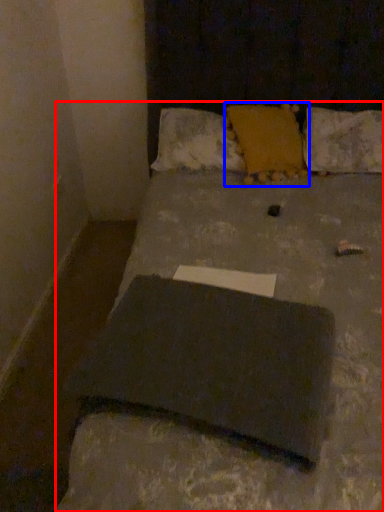
Question: Which object appears closest to the camera in this image, bed (highlighted by a red box) or pillow (highlighted by a blue box)?

Choices:
 (A) bed
 (B) pillow

Answer: (A)